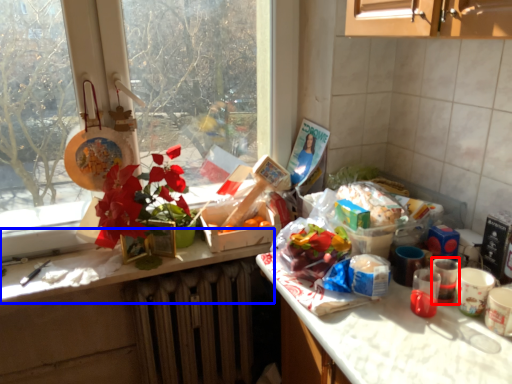
Question: Which object is closer to the camera taking this photo, coffee cup (highlighted by a red box) or counter top (highlighted by a blue box)?

Choices:
 (A) coffee cup
 (B) counter top

Answer: (A)